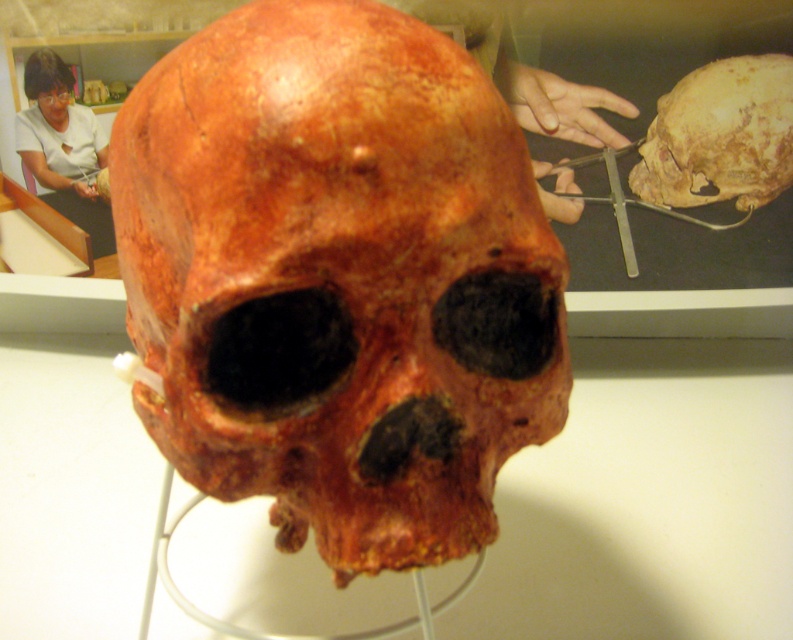
Question: Among these objects, which one is farthest from the camera?

Choices:
 (A) matte brown skull at center
 (B) matte white shirt at upper left

Answer: (A)

Question: Can you confirm if matte brown skull at center is bigger than matte white shirt at upper left?

Choices:
 (A) yes
 (B) no

Answer: (A)

Question: Which of the following is the farthest from the observer?

Choices:
 (A) (125, 282)
 (B) (745, 60)
 (C) (98, 156)

Answer: (C)

Question: Is matte brown skull at center below matte white shirt at upper left?

Choices:
 (A) no
 (B) yes

Answer: (B)

Question: Among these points, which one is farthest from the camera?

Choices:
 (A) (692, 132)
 (B) (43, 177)

Answer: (B)

Question: Does rusty brown skull at center appear under matte white shirt at upper left?

Choices:
 (A) yes
 (B) no

Answer: (A)